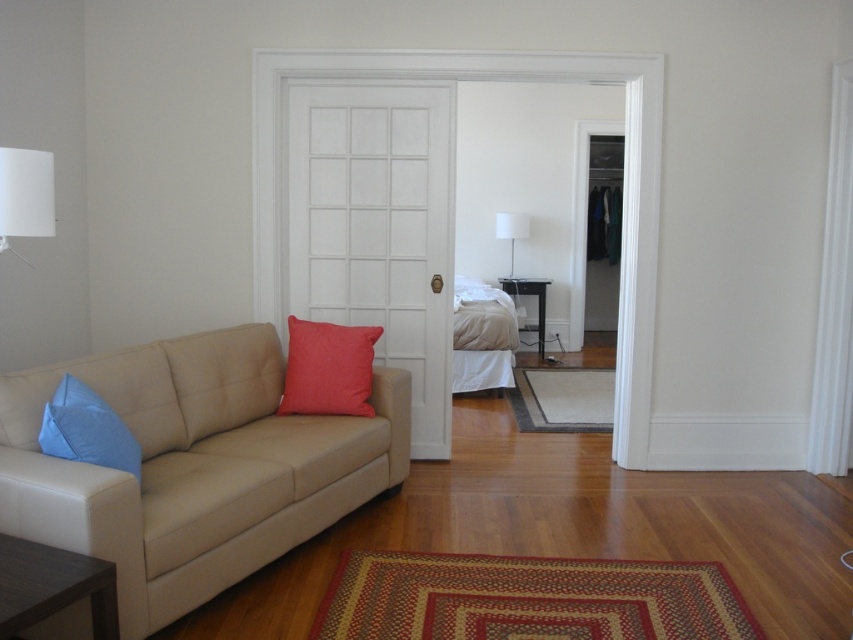
You are moving a large piece of furniture into the living room. The white fabric bed at center and the white matte lampshade at upper left are already present. Which object will require more space to accommodate?

The white fabric bed at center requires more space since it is larger in size than the white matte lampshade at upper left.

You are a delivery person trying to deliver a package to the living room. You see the white matte door at center and the white fabric lampshade at center. Which object is bigger and can you fit the package through the door?

The white matte door at center is larger than the white fabric lampshade at center. Since the door is bigger, you can fit the package through the white matte door at center if it is open.